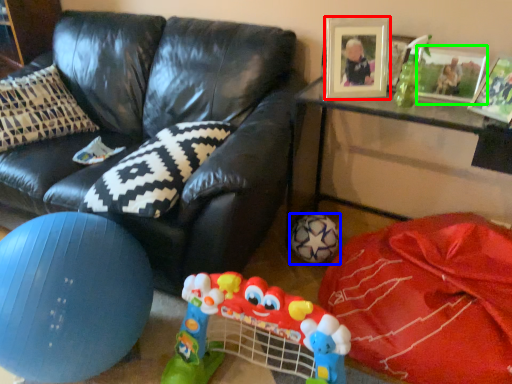
Question: Considering the real-world distances, which object is closest to picture frame (highlighted by a red box)? football (highlighted by a blue box) or picture frame (highlighted by a green box).

Choices:
 (A) football
 (B) picture frame

Answer: (B)